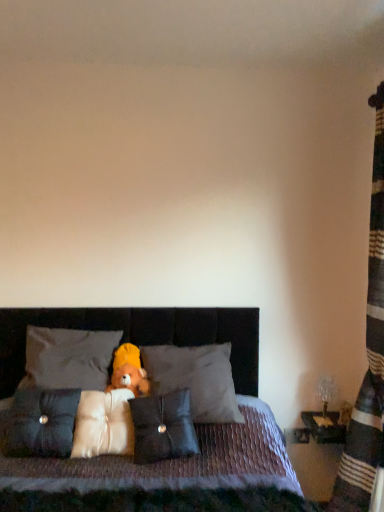
What do you see at coordinates (174, 476) in the screenshot?
I see `velvet-like brown bed at center` at bounding box center [174, 476].

At what (x,y) coordinates should I click in order to perform the action: click on soft plush teddy bear at center. Please return your answer as a coordinate pair (x, y). The width and height of the screenshot is (384, 512). Looking at the image, I should click on (129, 371).

You are a GUI agent. You are given a task and a screenshot of the screen. Output one action in this format:
    pyautogui.click(x=<x>, y=<y>)
    Task: Click on the dark gray fabric pillow at center, which is counted as the 5th pillow, starting from the left
    
    Given the screenshot: What is the action you would take?
    pyautogui.click(x=196, y=379)

This screenshot has width=384, height=512. What do you see at coordinates (163, 426) in the screenshot? I see `black leather pillow at center, the fourth pillow when ordered from left to right` at bounding box center [163, 426].

Identify the location of white fabric pillow at center, the fourth pillow viewed from the right. This screenshot has width=384, height=512. (69, 358).

Is satin black pillow at center, acting as the fifth pillow starting from the right, completely or partially inside velvet-like brown bed at center?

Yes, satin black pillow at center, acting as the fifth pillow starting from the right, is surrounded by velvet-like brown bed at center.

From the image's perspective, is velvet-like brown bed at center on satin black pillow at center, acting as the fifth pillow starting from the right?

No, from the image's perspective, velvet-like brown bed at center is not over satin black pillow at center, acting as the fifth pillow starting from the right.

Is velvet-like brown bed at center facing away from satin black pillow at center, acting as the fifth pillow starting from the right?

Absolutely, velvet-like brown bed at center is directed away from satin black pillow at center, acting as the fifth pillow starting from the right.

Does point (37, 372) lie behind point (345, 474)?

No, (37, 372) is in front of (345, 474).

Locate an element on the screen. the 1st pillow below the striped fabric curtain at right (from the image's perspective) is located at coordinates (69, 358).

Could you tell me if white fabric pillow at center, the second pillow from the left, is facing striped fabric curtain at right?

No, white fabric pillow at center, the second pillow from the left, is not oriented towards striped fabric curtain at right.

Are white fabric pillow at center, the fourth pillow viewed from the right, and striped fabric curtain at right beside each other?

white fabric pillow at center, the fourth pillow viewed from the right, and striped fabric curtain at right are not in contact.

Considering the relative positions of dark gray fabric pillow at center, placed as the first pillow when sorted from right to left, and white soft pillow at center, positioned as the third pillow in right-to-left order, in the image provided, is dark gray fabric pillow at center, placed as the first pillow when sorted from right to left, in front of white soft pillow at center, positioned as the third pillow in right-to-left order,?

No, it is not.

Is dark gray fabric pillow at center, placed as the first pillow when sorted from right to left, facing away from white soft pillow at center, arranged as the 3th pillow when viewed from the left?

No, dark gray fabric pillow at center, placed as the first pillow when sorted from right to left,'s orientation is not away from white soft pillow at center, arranged as the 3th pillow when viewed from the left.

From a real-world perspective, is dark gray fabric pillow at center, placed as the first pillow when sorted from right to left, on top of white soft pillow at center, positioned as the third pillow in right-to-left order?

Yes, from a real-world perspective, dark gray fabric pillow at center, placed as the first pillow when sorted from right to left, is over white soft pillow at center, positioned as the third pillow in right-to-left order

Does dark gray fabric pillow at center, which is counted as the 5th pillow, starting from the left, have a lesser width compared to white soft pillow at center, positioned as the third pillow in right-to-left order?

In fact, dark gray fabric pillow at center, which is counted as the 5th pillow, starting from the left, might be wider than white soft pillow at center, positioned as the third pillow in right-to-left order.

From the image's perspective, between black leather pillow at center, acting as the second pillow starting from the right, and satin black pillow at center, which ranks as the first pillow in left-to-right order, who is located below?

black leather pillow at center, acting as the second pillow starting from the right, appears lower in the image.

Is black leather pillow at center, the fourth pillow when ordered from left to right, oriented towards satin black pillow at center, acting as the fifth pillow starting from the right?

No, black leather pillow at center, the fourth pillow when ordered from left to right, is not oriented towards satin black pillow at center, acting as the fifth pillow starting from the right.

How far apart are black leather pillow at center, acting as the second pillow starting from the right, and satin black pillow at center, which ranks as the first pillow in left-to-right order?

black leather pillow at center, acting as the second pillow starting from the right, and satin black pillow at center, which ranks as the first pillow in left-to-right order, are 38.11 centimeters apart.

From the image's perspective, is velvet-like brown bed at center on top of black leather pillow at center, acting as the second pillow starting from the right?

Incorrect, from the image's perspective, velvet-like brown bed at center is lower than black leather pillow at center, acting as the second pillow starting from the right.

Does velvet-like brown bed at center contain black leather pillow at center, the fourth pillow when ordered from left to right?

Yes.

Is velvet-like brown bed at center oriented towards black leather pillow at center, the fourth pillow when ordered from left to right?

Yes, velvet-like brown bed at center is oriented towards black leather pillow at center, the fourth pillow when ordered from left to right.

Consider the image. Is velvet-like brown bed at center behind black leather pillow at center, acting as the second pillow starting from the right?

No, it is not.

Between velvet-like brown bed at center and striped fabric curtain at right, which one has smaller size?

Smaller between the two is striped fabric curtain at right.

Identify the location of curtain behind the velvet-like brown bed at center. (368, 355).

Between velvet-like brown bed at center and striped fabric curtain at right, which one has larger width?

With larger width is velvet-like brown bed at center.

Would you say striped fabric curtain at right is part of velvet-like brown bed at center's contents?

Definitely not — striped fabric curtain at right is not inside velvet-like brown bed at center.

How different are the orientations of striped fabric curtain at right and black leather pillow at center, acting as the second pillow starting from the right, in degrees?

76.8 degrees.

Is striped fabric curtain at right completely or partially outside of black leather pillow at center, the fourth pillow when ordered from left to right?

striped fabric curtain at right is positioned outside black leather pillow at center, the fourth pillow when ordered from left to right.

Can you confirm if striped fabric curtain at right is positioned to the right of black leather pillow at center, acting as the second pillow starting from the right?

Correct, you'll find striped fabric curtain at right to the right of black leather pillow at center, acting as the second pillow starting from the right.

Is striped fabric curtain at right wider or thinner than black leather pillow at center, acting as the second pillow starting from the right?

Considering their sizes, striped fabric curtain at right looks broader than black leather pillow at center, acting as the second pillow starting from the right.

Locate an element on the screen. The width and height of the screenshot is (384, 512). the 3rd pillow to the left of the velvet-like brown bed at center, starting your count from the anchor is located at coordinates (42, 423).

Where is `curtain that is on the right side of white fabric pillow at center, the fourth pillow viewed from the right`? This screenshot has width=384, height=512. curtain that is on the right side of white fabric pillow at center, the fourth pillow viewed from the right is located at coordinates (368, 355).

Which object lies nearer to the anchor point dark gray fabric pillow at center, placed as the first pillow when sorted from right to left, white fabric pillow at center, the second pillow from the left, or satin black pillow at center, acting as the fifth pillow starting from the right?

The object closer to dark gray fabric pillow at center, placed as the first pillow when sorted from right to left, is white fabric pillow at center, the second pillow from the left.

Estimate the real-world distances between objects in this image. Which object is closer to velvet-like brown bed at center, striped fabric curtain at right or soft plush teddy bear at center?

soft plush teddy bear at center is positioned closer to the anchor velvet-like brown bed at center.

Considering their positions, is white soft pillow at center, arranged as the 3th pillow when viewed from the left, positioned further to dark gray fabric pillow at center, which is counted as the 5th pillow, starting from the left, than white fabric pillow at center, the fourth pillow viewed from the right?

Among the two, white fabric pillow at center, the fourth pillow viewed from the right, is located further to dark gray fabric pillow at center, which is counted as the 5th pillow, starting from the left.

Looking at the image, which one is located closer to soft plush teddy bear at center, striped fabric curtain at right or white soft pillow at center, positioned as the third pillow in right-to-left order?

Based on the image, white soft pillow at center, positioned as the third pillow in right-to-left order, appears to be nearer to soft plush teddy bear at center.

When comparing their distances from white soft pillow at center, positioned as the third pillow in right-to-left order, does black leather pillow at center, acting as the second pillow starting from the right, or white fabric pillow at center, the fourth pillow viewed from the right, seem closer?

black leather pillow at center, acting as the second pillow starting from the right, is closer to white soft pillow at center, positioned as the third pillow in right-to-left order.

Considering their positions, is dark gray fabric pillow at center, placed as the first pillow when sorted from right to left, positioned further to white soft pillow at center, positioned as the third pillow in right-to-left order, than striped fabric curtain at right?

Among the two, striped fabric curtain at right is located further to white soft pillow at center, positioned as the third pillow in right-to-left order.

From the picture: Looking at the image, which one is located further to white fabric pillow at center, the second pillow from the left, striped fabric curtain at right or satin black pillow at center, acting as the fifth pillow starting from the right?

striped fabric curtain at right lies further to white fabric pillow at center, the second pillow from the left, than the other object.

When comparing their distances from dark gray fabric pillow at center, which is counted as the 5th pillow, starting from the left, does black leather pillow at center, acting as the second pillow starting from the right, or white fabric pillow at center, the second pillow from the left, seem closer?

black leather pillow at center, acting as the second pillow starting from the right, is positioned closer to the anchor dark gray fabric pillow at center, which is counted as the 5th pillow, starting from the left.

Where is `pillow located between black leather pillow at center, acting as the second pillow starting from the right, and striped fabric curtain at right in the left-right direction`? The height and width of the screenshot is (512, 384). pillow located between black leather pillow at center, acting as the second pillow starting from the right, and striped fabric curtain at right in the left-right direction is located at coordinates (196, 379).

Where is `pillow between white soft pillow at center, arranged as the 3th pillow when viewed from the left, and dark gray fabric pillow at center, placed as the first pillow when sorted from right to left, from left to right`? pillow between white soft pillow at center, arranged as the 3th pillow when viewed from the left, and dark gray fabric pillow at center, placed as the first pillow when sorted from right to left, from left to right is located at coordinates (163, 426).

Locate an element on the screen. This screenshot has height=512, width=384. teddy bear situated between satin black pillow at center, which ranks as the first pillow in left-to-right order, and black leather pillow at center, the fourth pillow when ordered from left to right, from left to right is located at coordinates (129, 371).

This screenshot has height=512, width=384. What are the coordinates of `teddy bear between satin black pillow at center, which ranks as the first pillow in left-to-right order, and dark gray fabric pillow at center, placed as the first pillow when sorted from right to left` in the screenshot? It's located at click(129, 371).